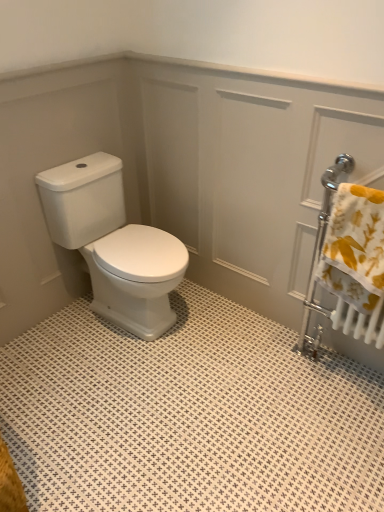
Question: From the image's perspective, relative to white glossy toilet at center, is white glossy screen door at center above or below?

Choices:
 (A) below
 (B) above

Answer: (B)

Question: Is white glossy screen door at center inside the boundaries of white glossy toilet at center, or outside?

Choices:
 (A) inside
 (B) outside

Answer: (B)

Question: Which is farther from the white glossy screen door at center?

Choices:
 (A) white glossy toilet at center
 (B) yellow floral fabric at right

Answer: (B)

Question: Which object is positioned closest to the white glossy toilet at center?

Choices:
 (A) white glossy screen door at center
 (B) yellow floral fabric at right

Answer: (A)